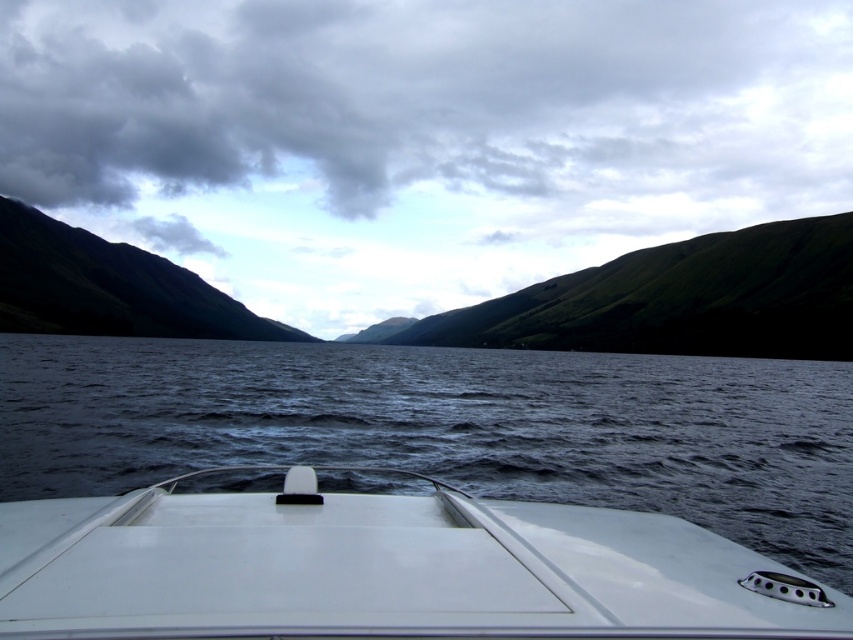
From the picture: Can you confirm if green grassy hill at center is taller than green grassy mountain at left?

No, green grassy hill at center is not taller than green grassy mountain at left.

Who is positioned more to the right, green grassy hill at center or green grassy mountain at left?

green grassy hill at center is more to the right.

Between point (338, 339) and point (36, 314), which one is positioned in front?

Point (36, 314) is more forward.

Identify the location of green grassy hill at center. The image size is (853, 640). (675, 300).

How distant is white glossy boat at center from green grassy mountain at left?

white glossy boat at center is 1130.96 feet from green grassy mountain at left.

Who is positioned more to the left, white glossy boat at center or green grassy mountain at left?

green grassy mountain at left

Image resolution: width=853 pixels, height=640 pixels. Describe the element at coordinates (384, 568) in the screenshot. I see `white glossy boat at center` at that location.

Locate an element on the screen. The height and width of the screenshot is (640, 853). white glossy boat at center is located at coordinates (384, 568).

Does point (505, 545) come farther from viewer compared to point (647, 266)?

No, (505, 545) is in front of (647, 266).

Who is shorter, white glossy boat at center or green grassy hill at center?

white glossy boat at center

Find the location of a particular element. This screenshot has height=640, width=853. white glossy boat at center is located at coordinates (384, 568).